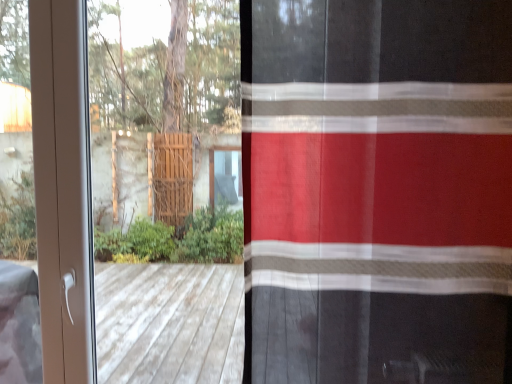
What do you see at coordinates (63, 188) in the screenshot?
I see `white plastic screen door at left` at bounding box center [63, 188].

You are a GUI agent. You are given a task and a screenshot of the screen. Output one action in this format:
    pyautogui.click(x=<x>, y=<y>)
    Task: Click on the white plastic screen door at left
    
    Given the screenshot: What is the action you would take?
    pyautogui.click(x=63, y=188)

Where is `red sheer curtain at right`? red sheer curtain at right is located at coordinates (377, 191).

In order to face red sheer curtain at right, should I rotate leftwards or rightwards?

Rotate right and turn 16.579 degrees.

Measure the distance between point (382, 364) and camera.

The distance of point (382, 364) from camera is 34.84 inches.

What do you see at coordinates (377, 191) in the screenshot?
I see `red sheer curtain at right` at bounding box center [377, 191].

What are the coordinates of `white plastic screen door at left` in the screenshot? It's located at (63, 188).

Considering the positions of objects white plastic screen door at left and red sheer curtain at right in the image provided, who is more to the right, white plastic screen door at left or red sheer curtain at right?

red sheer curtain at right is more to the right.

Which object is further away from the camera, white plastic screen door at left or red sheer curtain at right?

Positioned behind is white plastic screen door at left.

Which is farther, (82, 311) or (408, 4)?

The point (82, 311) is behind.

From the image's perspective, is white plastic screen door at left positioned above or below red sheer curtain at right?

white plastic screen door at left is situated lower than red sheer curtain at right in the image.

From a real-world perspective, which is physically below, white plastic screen door at left or red sheer curtain at right?

white plastic screen door at left is physically lower.

Does white plastic screen door at left have a lesser width compared to red sheer curtain at right?

Yes.

Considering the sizes of white plastic screen door at left and red sheer curtain at right in the image, is white plastic screen door at left taller or shorter than red sheer curtain at right?

white plastic screen door at left is taller than red sheer curtain at right.

Is white plastic screen door at left bigger than red sheer curtain at right?

No.

Would you say white plastic screen door at left contains red sheer curtain at right?

Actually, red sheer curtain at right is outside white plastic screen door at left.

Is white plastic screen door at left beside red sheer curtain at right?

They are not placed beside each other.

Is white plastic screen door at left looking in the opposite direction of red sheer curtain at right?

white plastic screen door at left is not turned away from red sheer curtain at right.

How many degrees apart are the facing directions of white plastic screen door at left and red sheer curtain at right?

white plastic screen door at left and red sheer curtain at right are facing 1.91 degrees away from each other.

Where is `curtain lying above the white plastic screen door at left (from the image's perspective)`? curtain lying above the white plastic screen door at left (from the image's perspective) is located at coordinates (377, 191).

Between red sheer curtain at right and white plastic screen door at left, which one appears on the left side from the viewer's perspective?

white plastic screen door at left is more to the left.

Considering the positions of objects red sheer curtain at right and white plastic screen door at left in the image provided, who is in front, red sheer curtain at right or white plastic screen door at left?

Positioned in front is red sheer curtain at right.

Considering the positions of points (373, 112) and (86, 249), is point (373, 112) farther from camera compared to point (86, 249)?

No, it is in front of (86, 249).

From the image's perspective, would you say red sheer curtain at right is shown under white plastic screen door at left?

No, from the image's perspective, red sheer curtain at right is not below white plastic screen door at left.

From a real-world perspective, is red sheer curtain at right on white plastic screen door at left?

Yes.

Is red sheer curtain at right wider than white plastic screen door at left?

Yes, red sheer curtain at right is wider than white plastic screen door at left.

Between red sheer curtain at right and white plastic screen door at left, which one has less height?

red sheer curtain at right is shorter.

Considering the relative sizes of red sheer curtain at right and white plastic screen door at left in the image provided, is red sheer curtain at right smaller than white plastic screen door at left?

No, red sheer curtain at right is not smaller than white plastic screen door at left.

Is white plastic screen door at left located within red sheer curtain at right?

No, red sheer curtain at right does not contain white plastic screen door at left.

Are red sheer curtain at right and white plastic screen door at left beside each other?

red sheer curtain at right and white plastic screen door at left are clearly separated.

Is red sheer curtain at right positioned with its back to white plastic screen door at left?

red sheer curtain at right is not turned away from white plastic screen door at left.

How many degrees apart are the facing directions of red sheer curtain at right and white plastic screen door at left?

The angle between the facing direction of red sheer curtain at right and the facing direction of white plastic screen door at left is 1.91 degrees.

Measure the distance between red sheer curtain at right and white plastic screen door at left.

red sheer curtain at right and white plastic screen door at left are 31.92 inches apart from each other.

You are a GUI agent. You are given a task and a screenshot of the screen. Output one action in this format:
    pyautogui.click(x=<x>, y=<y>)
    Task: Click on the screen door located behind the red sheer curtain at right
    This screenshot has width=512, height=384.
    Given the screenshot: What is the action you would take?
    pyautogui.click(x=63, y=188)

In the image, there is a red sheer curtain at right. Identify the location of screen door below it (from a real-world perspective). The image size is (512, 384). (63, 188).

Where is `curtain that is above the white plastic screen door at left (from the image's perspective)`? The height and width of the screenshot is (384, 512). curtain that is above the white plastic screen door at left (from the image's perspective) is located at coordinates (377, 191).